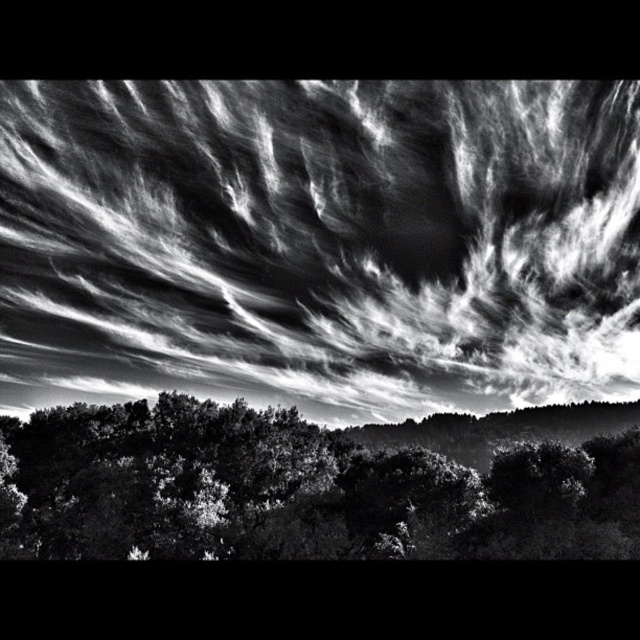
Question: Which point is closer to the camera?

Choices:
 (A) (268, 452)
 (B) (557, 362)

Answer: (A)

Question: Does white textured clouds at upper center appear on the right side of dense foliage at bottom?

Choices:
 (A) yes
 (B) no

Answer: (B)

Question: Does white textured clouds at upper center appear under dense foliage at bottom?

Choices:
 (A) no
 (B) yes

Answer: (A)

Question: Does white textured clouds at upper center appear under dense foliage at bottom?

Choices:
 (A) yes
 (B) no

Answer: (B)